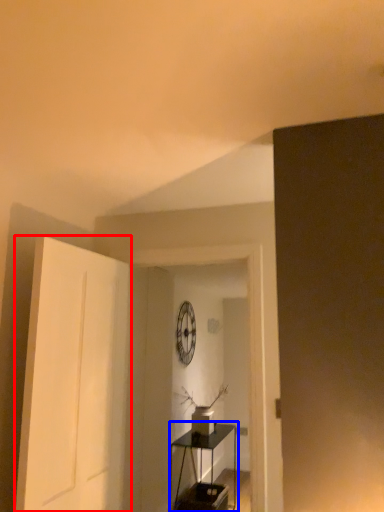
Question: Which point is further to the camera, door (highlighted by a red box) or table (highlighted by a blue box)?

Choices:
 (A) door
 (B) table

Answer: (B)